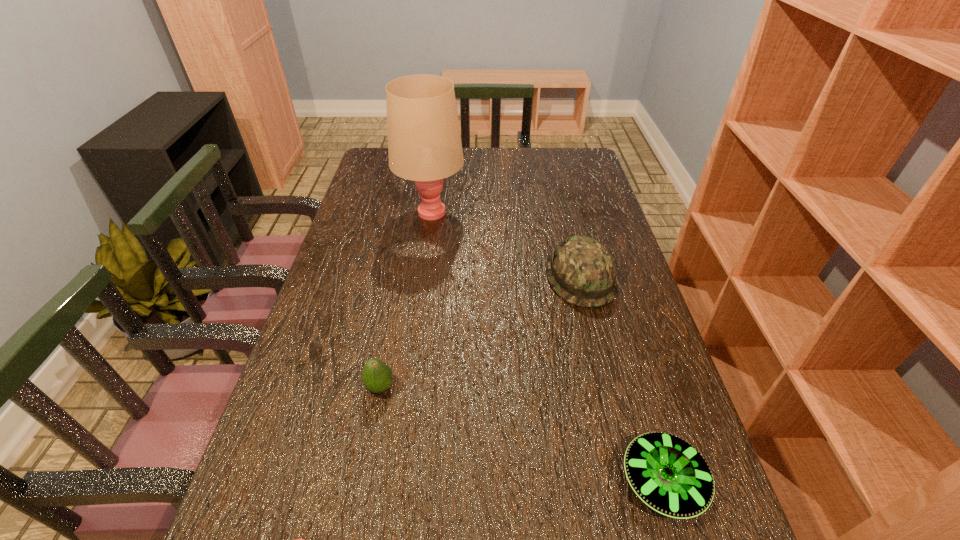
Where is `free space located 0.050m on the back of the third nearest object`? free space located 0.050m on the back of the third nearest object is located at coordinates (386, 357).

You are a GUI agent. You are given a task and a screenshot of the screen. Output one action in this format:
    pyautogui.click(x=<x>, y=<y>)
    Task: Click on the vacant position located 0.230m on the left of the second shortest object
    
    Given the screenshot: What is the action you would take?
    pyautogui.click(x=497, y=482)

Find the location of `object that is positioned at the left edge`. object that is positioned at the left edge is located at coordinates (424, 144).

At what (x,y) coordinates should I click in order to perform the action: click on headwear present at the right edge. Please return your answer as a coordinate pair (x, y). Looking at the image, I should click on (581, 270).

You are a GUI agent. You are given a task and a screenshot of the screen. Output one action in this format:
    pyautogui.click(x=<x>, y=<y>)
    Task: Click on the saucer at the right edge
    Image resolution: width=960 pixels, height=540 pixels.
    Given the screenshot: What is the action you would take?
    pyautogui.click(x=668, y=474)

Where is `free space at the far edge of the desktop`? The image size is (960, 540). free space at the far edge of the desktop is located at coordinates (524, 150).

This screenshot has height=540, width=960. In order to click on free location at the left edge of the desktop in this screenshot , I will do `click(381, 192)`.

Find the location of a particular element. The height and width of the screenshot is (540, 960). vacant space at the right edge is located at coordinates (573, 210).

The image size is (960, 540). Identify the location of free space between the saucer and the headwear. tap(621, 380).

This screenshot has height=540, width=960. Identify the location of unoccupied position between the avocado and the second tallest object. (480, 333).